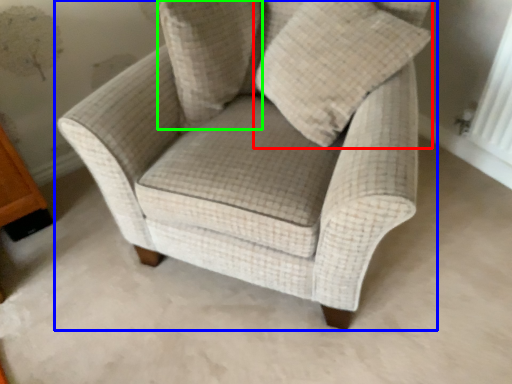
Question: Considering the real-world distances, which object is closest to throw pillow (highlighted by a red box)? chair (highlighted by a blue box) or pillow (highlighted by a green box).

Choices:
 (A) chair
 (B) pillow

Answer: (A)